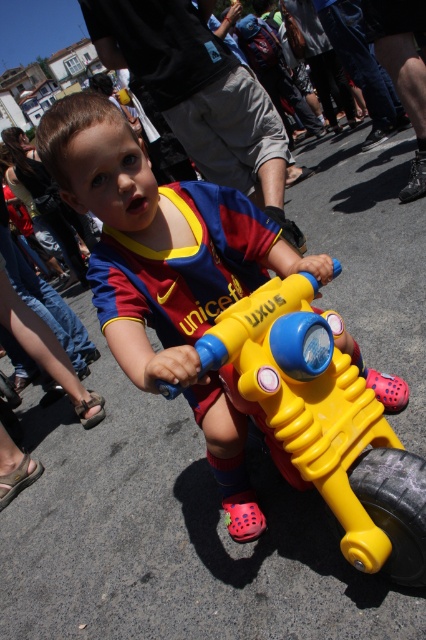
You are a photographer trying to capture the child riding the bright yellow toy motorcycle. You want to focus on the yellow plastic toy at center located at point (172, 276). Where should you aim your camera to ensure the yellow plastic toy at center is in the center of your photo?

You should aim your camera directly at the point (172, 276) where the yellow plastic toy at center is located to ensure it is centered in your photo.

You are a parent trying to decide whether to let your child play with the yellow plastic toy car at center and the black rubber tire at lower right. Considering their sizes, which one is more suitable for a toddler to handle easily?

The yellow plastic toy car at center is bigger than the black rubber tire at lower right, so the yellow plastic toy car at center is more suitable for a toddler to handle easily due to its larger size.

You are a parent trying to decide if your child can safely stand on the yellow plastic toy at center while holding the black rubber tire at lower right. Based on their sizes, is this feasible?

The yellow plastic toy at center is taller than the black rubber tire at lower right, so the child can safely stand on the yellow plastic toy at center while holding the black rubber tire at lower right.